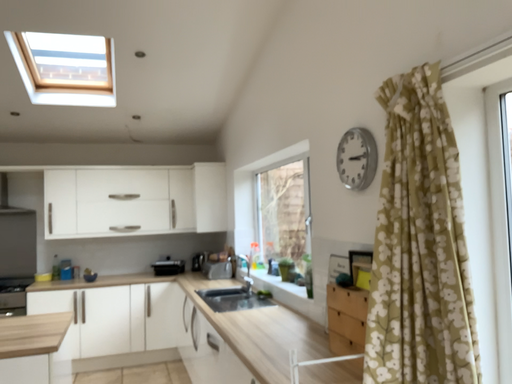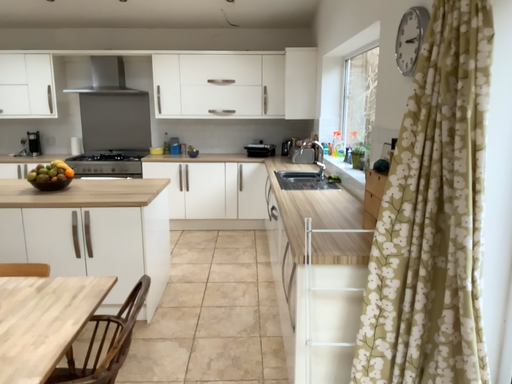
Question: How did the camera likely rotate when shooting the video?

Choices:
 (A) rotated downward
 (B) rotated upward

Answer: (A)